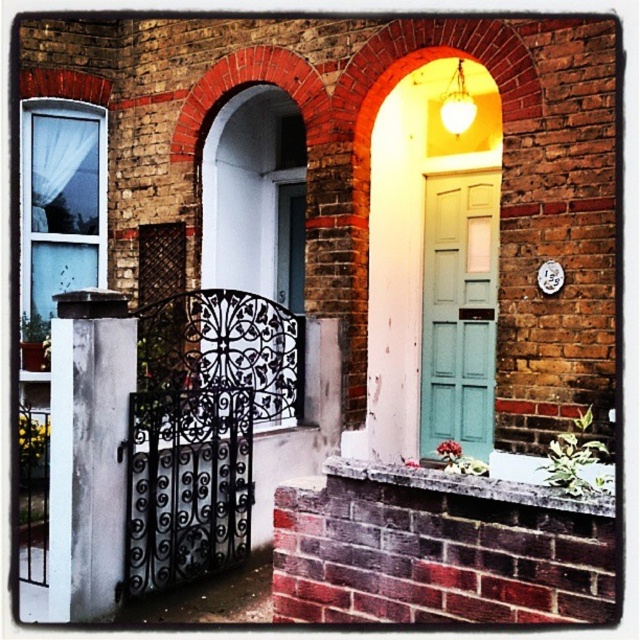
Where is `teal matte door at center`? The width and height of the screenshot is (640, 640). teal matte door at center is located at coordinates (458, 310).

Where is `teal matte door at center`? This screenshot has width=640, height=640. teal matte door at center is located at coordinates (458, 310).